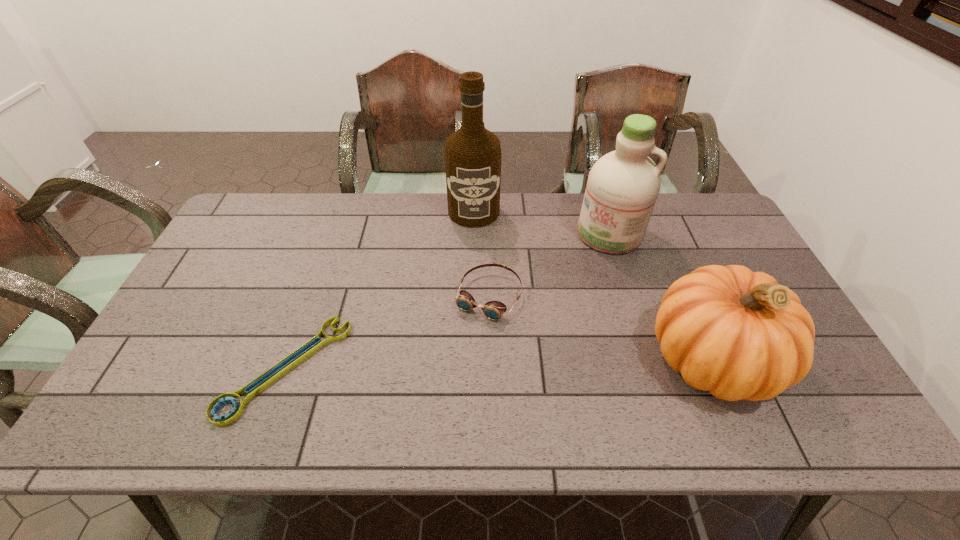
Find the location of a particular element. vacant space on the desktop that is between the leftmost object and the third shortest object and is positioned through the lenses of the second shortest object is located at coordinates (451, 364).

Where is `free space on the desktop that is between the wrench and the pumpkin and is positioned on the label of the alcohol`? The height and width of the screenshot is (540, 960). free space on the desktop that is between the wrench and the pumpkin and is positioned on the label of the alcohol is located at coordinates (478, 363).

Identify the location of vacant space on the desktop that is between the leftmost object and the pumpkin and is positioned on the front label of the second tallest object. The height and width of the screenshot is (540, 960). (525, 362).